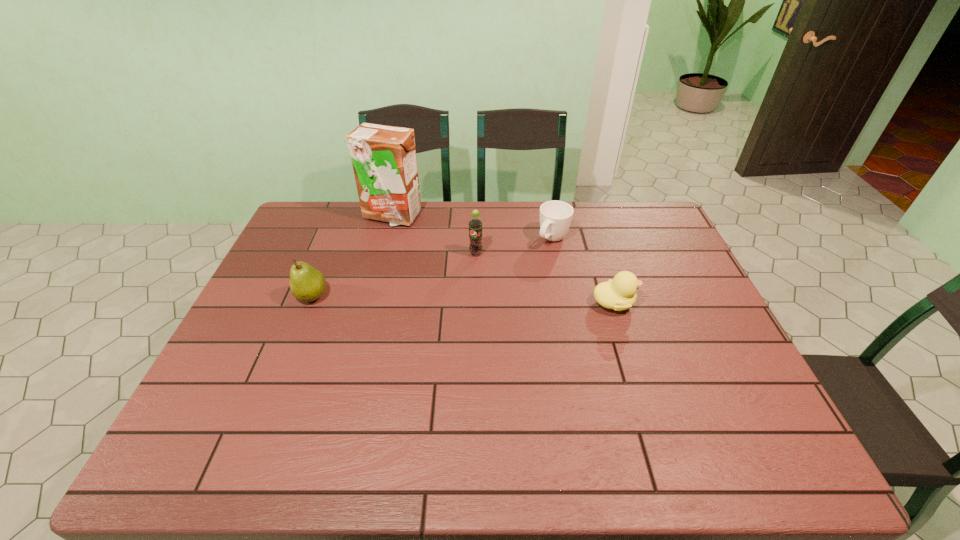
What are the coordinates of `the third tallest object` in the screenshot? It's located at (307, 284).

Locate an element on the screen. the leftmost object is located at coordinates (307, 284).

Find the location of a particular element. duckling is located at coordinates (619, 294).

Image resolution: width=960 pixels, height=540 pixels. Find the location of `the second object from right to left`. the second object from right to left is located at coordinates (555, 216).

Where is `the third object from left to right`? This screenshot has height=540, width=960. the third object from left to right is located at coordinates (475, 223).

This screenshot has width=960, height=540. Find the location of `the second tallest object`. the second tallest object is located at coordinates (475, 223).

The image size is (960, 540). What are the coordinates of `the second object from left to right` in the screenshot? It's located at (383, 157).

Locate an element on the screen. the tallest object is located at coordinates (383, 157).

Where is `vacant area situated on the right of the leftmost object`? vacant area situated on the right of the leftmost object is located at coordinates (425, 296).

Find the location of a particular element. Image resolution: width=960 pixels, height=540 pixels. blank space located 0.190m at the beak of the duckling is located at coordinates click(703, 303).